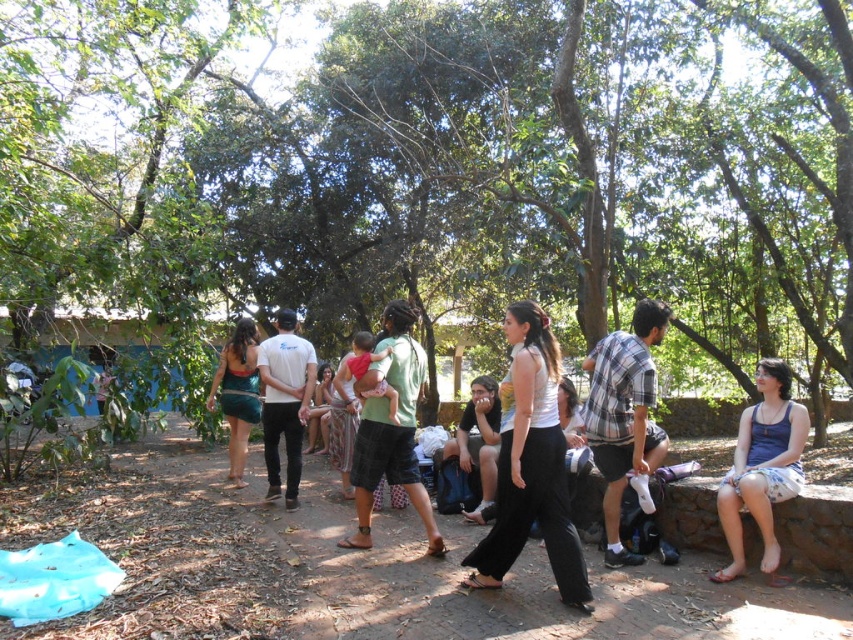
Who is positioned more to the right, green cotton shirt at center or green textured shirt at center?

green cotton shirt at center is more to the right.

Can you confirm if green cotton shirt at center is taller than green textured shirt at center?

Yes, green cotton shirt at center is taller than green textured shirt at center.

Who is more distant from viewer, (535, 314) or (343, 477)?

Point (343, 477)

The width and height of the screenshot is (853, 640). I want to click on green cotton shirt at center, so click(x=531, y=467).

Is point (550, 381) less distant than point (770, 561)?

Yes, it is.

Describe the element at coordinates (531, 467) in the screenshot. Image resolution: width=853 pixels, height=640 pixels. I see `white cotton tank top at center` at that location.

Does point (515, 374) come behind point (804, 445)?

No, (515, 374) is in front of (804, 445).

What are the coordinates of `white cotton tank top at center` in the screenshot? It's located at (531, 467).

Is point (415, 371) closer to camera compared to point (740, 540)?

That is False.

Which of these two, green matte shirt at center or blue fabric skirt at lower right, stands shorter?

Standing shorter between the two is blue fabric skirt at lower right.

Identify the location of green matte shirt at center. This screenshot has width=853, height=640. (390, 428).